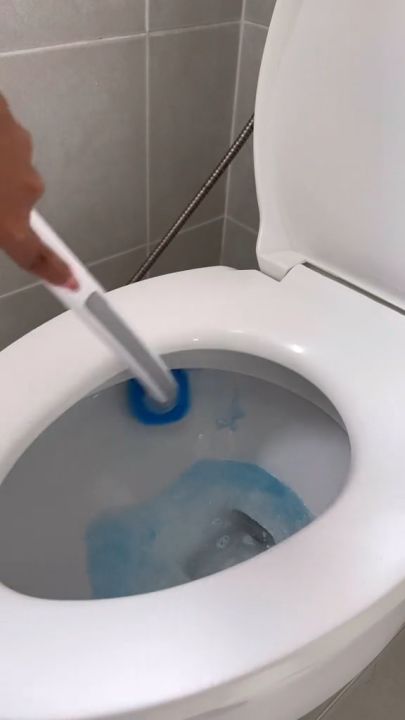
Where is `seat`? The height and width of the screenshot is (720, 405). seat is located at coordinates (365, 99).